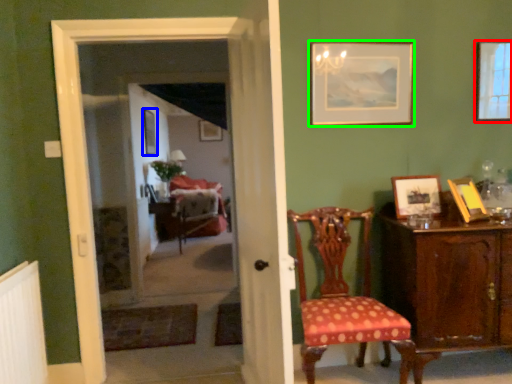
Question: Based on their relative distances, which object is nearer to picture frame (highlighted by a red box)? Choose from picture frame (highlighted by a blue box) and picture frame (highlighted by a green box).

Choices:
 (A) picture frame
 (B) picture frame

Answer: (B)